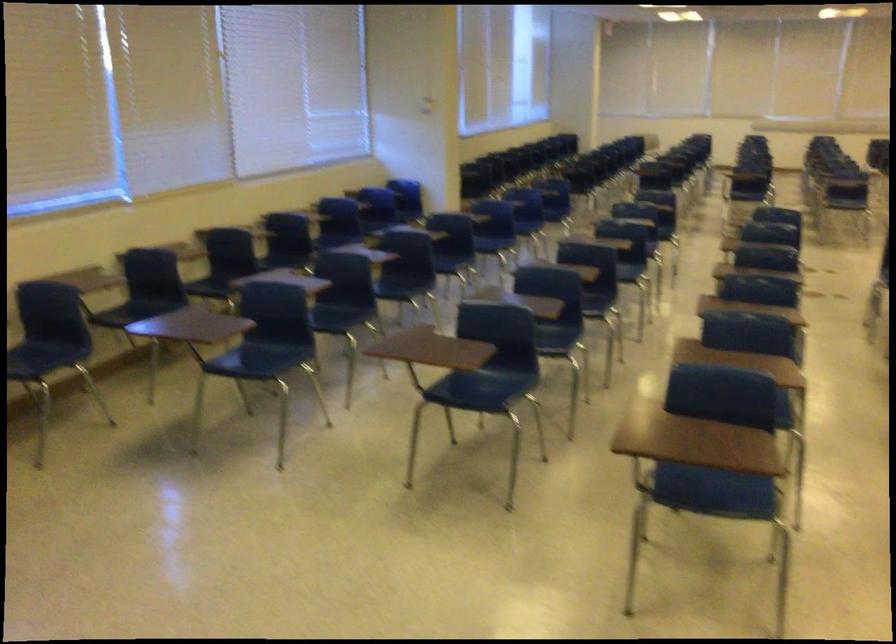
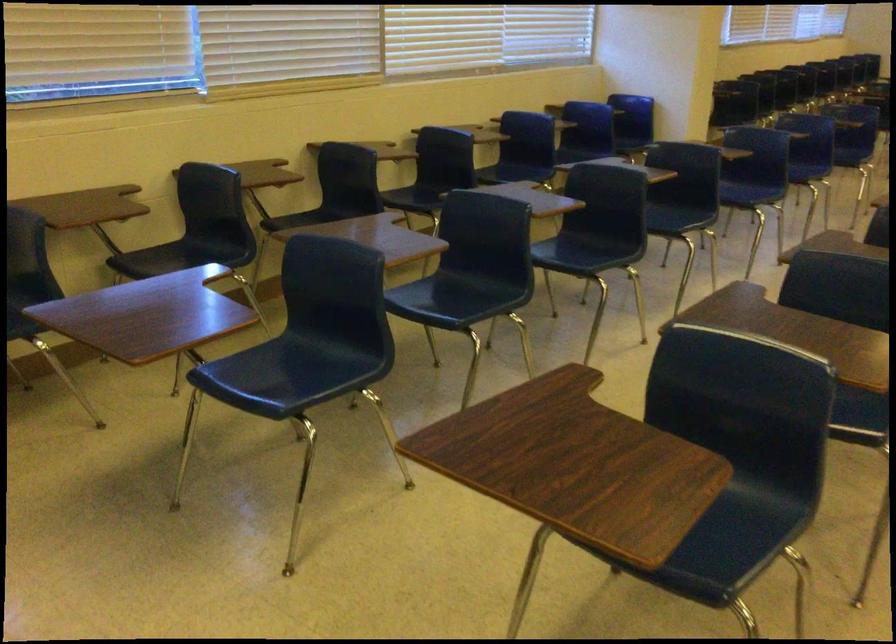
The point at (135, 310) is marked in the first image. Where is the corresponding point in the second image?

(181, 257)